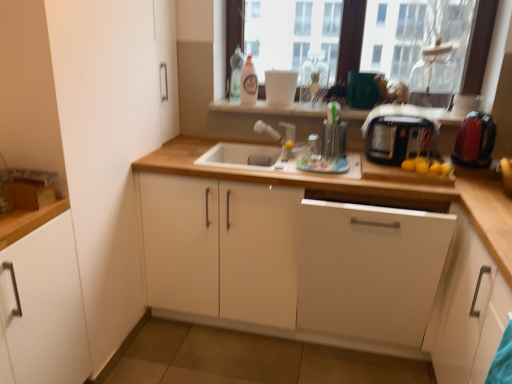
Describe the element at coordinates (270, 108) in the screenshot. I see `matte white window sill at upper center` at that location.

Find the location of a particular element. white matte cabinet at center, placed as the 3th cabinetry when sorted from left to right is located at coordinates point(370,270).

What do you see at coordinates (475, 141) in the screenshot? I see `shiny red plastic kettle at right` at bounding box center [475, 141].

This screenshot has height=384, width=512. Describe the element at coordinates (248, 83) in the screenshot. I see `white glossy bottle at upper center, marked as the second bottle in a right-to-left arrangement` at that location.

Measure the distance between point (490, 338) and camera.

Point (490, 338) is 1.30 meters away from camera.

What do you see at coordinates (397, 138) in the screenshot? The image size is (512, 384). I see `black plastic toaster at right` at bounding box center [397, 138].

Image resolution: width=512 pixels, height=384 pixels. In order to click on transparent glass window at upper center in this screenshot , I will do `click(479, 46)`.

Is black plastic toaster at right taller than white matte cabinet at lower right, which ranks as the second cabinetry in right-to-left order?

In fact, black plastic toaster at right may be shorter than white matte cabinet at lower right, which ranks as the second cabinetry in right-to-left order.

How different are the orientations of black plastic toaster at right and white matte cabinet at lower right, which ranks as the second cabinetry in right-to-left order, in degrees?

There is a 93.4-degree angle between the facing directions of black plastic toaster at right and white matte cabinet at lower right, which ranks as the second cabinetry in right-to-left order.

Identify the location of the 1st cabinetry positioned below the black plastic toaster at right (from a real-world perspective). (492, 328).

Measure the distance from black plastic toaster at right to white matte cabinet at lower right, which ranks as the second cabinetry in right-to-left order.

32.39 inches.

Is satin nickel faucet at center to the left of white matte cabinet at right, which is the 1th cabinetry from right to left, from the viewer's perspective?

Indeed, satin nickel faucet at center is positioned on the left side of white matte cabinet at right, which is the 1th cabinetry from right to left.

In terms of size, does satin nickel faucet at center appear bigger or smaller than white matte cabinet at right, which is the 1th cabinetry from right to left?

Considering their sizes, satin nickel faucet at center takes up less space than white matte cabinet at right, which is the 1th cabinetry from right to left.

Does satin nickel faucet at center come behind white matte cabinet at right, which is the 1th cabinetry from right to left?

Yes, it is.

Locate an element on the screen. This screenshot has width=512, height=384. faucet behind the white matte cabinet at right, the fifth cabinetry when ordered from left to right is located at coordinates (273, 136).

In the scene shown: Considering the relative sizes of white matte cabinet at lower right, the fourth cabinetry in the left-to-right sequence, and white matte cabinet at left, which is counted as the 1th cabinetry, starting from the left, in the image provided, is white matte cabinet at lower right, the fourth cabinetry in the left-to-right sequence, thinner than white matte cabinet at left, which is counted as the 1th cabinetry, starting from the left,?

Yes.

From a real-world perspective, who is located higher, white matte cabinet at lower right, which ranks as the second cabinetry in right-to-left order, or white matte cabinet at left, which is the fifth cabinetry in right-to-left order?

white matte cabinet at lower right, which ranks as the second cabinetry in right-to-left order.

From the image's perspective, which is above, white matte cabinet at lower right, which ranks as the second cabinetry in right-to-left order, or white matte cabinet at left, which is counted as the 1th cabinetry, starting from the left?

white matte cabinet at left, which is counted as the 1th cabinetry, starting from the left, from the image's perspective.

In terms of width, does matte white window sill at upper center look wider or thinner when compared to white matte cabinet at right, the fifth cabinetry when ordered from left to right?

matte white window sill at upper center is thinner than white matte cabinet at right, the fifth cabinetry when ordered from left to right.

Consider the image. Based on their positions, is matte white window sill at upper center located to the left or right of white matte cabinet at right, which is the 1th cabinetry from right to left?

Clearly, matte white window sill at upper center is on the left of white matte cabinet at right, which is the 1th cabinetry from right to left, in the image.

Considering the relative sizes of matte white window sill at upper center and white matte cabinet at right, which is the 1th cabinetry from right to left, in the image provided, is matte white window sill at upper center bigger than white matte cabinet at right, which is the 1th cabinetry from right to left,?

No.

Is matte white window sill at upper center facing away from white matte cabinet at right, the fifth cabinetry when ordered from left to right?

No, matte white window sill at upper center is not facing the opposite direction of white matte cabinet at right, the fifth cabinetry when ordered from left to right.

Is shiny red plastic kettle at right with white matte cabinet at left, which is the fifth cabinetry in right-to-left order?

There is a gap between shiny red plastic kettle at right and white matte cabinet at left, which is the fifth cabinetry in right-to-left order.

In the scene shown: Is shiny red plastic kettle at right positioned with its back to white matte cabinet at left, which is the fifth cabinetry in right-to-left order?

No, shiny red plastic kettle at right is not facing the opposite direction of white matte cabinet at left, which is the fifth cabinetry in right-to-left order.

Is shiny red plastic kettle at right at the left side of white matte cabinet at left, which is counted as the 1th cabinetry, starting from the left?

No.

From a real-world perspective, is shiny red plastic kettle at right above or below white matte cabinet at left, which is the fifth cabinetry in right-to-left order?

In terms of real-world spatial position, shiny red plastic kettle at right is above white matte cabinet at left, which is the fifth cabinetry in right-to-left order.

Does translucent plastic bottle at upper center, the 1th bottle viewed from the left, touch black plastic toaster at right?

translucent plastic bottle at upper center, the 1th bottle viewed from the left, and black plastic toaster at right are clearly separated.

Which is closer, (231, 96) or (388, 147)?

The point (388, 147) is more forward.

How far apart are translucent plastic bottle at upper center, the third bottle positioned from the right, and black plastic toaster at right?

translucent plastic bottle at upper center, the third bottle positioned from the right, is 1.03 meters away from black plastic toaster at right.

Is translucent plastic bottle at upper center, the third bottle positioned from the right, spatially inside black plastic toaster at right, or outside of it?

The correct answer is: outside.

Would you say white matte cabinet at lower right, the fourth cabinetry in the left-to-right sequence, is inside or outside white matte cabinet at center, the 2th cabinetry positioned from the left?

white matte cabinet at lower right, the fourth cabinetry in the left-to-right sequence, is not inside white matte cabinet at center, the 2th cabinetry positioned from the left, it's outside.

In the scene shown: Considering the sizes of objects white matte cabinet at lower right, which ranks as the second cabinetry in right-to-left order, and white matte cabinet at center, the fourth cabinetry viewed from the right, in the image provided, who is smaller, white matte cabinet at lower right, which ranks as the second cabinetry in right-to-left order, or white matte cabinet at center, the fourth cabinetry viewed from the right,?

Smaller between the two is white matte cabinet at lower right, which ranks as the second cabinetry in right-to-left order.

What's the angular difference between white matte cabinet at lower right, which ranks as the second cabinetry in right-to-left order, and white matte cabinet at center, the 2th cabinetry positioned from the left,'s facing directions?

white matte cabinet at lower right, which ranks as the second cabinetry in right-to-left order, and white matte cabinet at center, the 2th cabinetry positioned from the left, are facing 93.6 degrees away from each other.

Is white matte cabinet at lower right, which ranks as the second cabinetry in right-to-left order, at the left side of white matte cabinet at center, the 2th cabinetry positioned from the left?

Incorrect, white matte cabinet at lower right, which ranks as the second cabinetry in right-to-left order, is not on the left side of white matte cabinet at center, the 2th cabinetry positioned from the left.

At what (x,y) coordinates should I click in order to perform the action: click on the 4th cabinetry in front when counting from the black plastic toaster at right. Please return your answer as a coordinate pair (x, y). Looking at the image, I should click on (492, 328).

Where is `faucet on the left of white matte cabinet at right, the fifth cabinetry when ordered from left to right`? This screenshot has height=384, width=512. faucet on the left of white matte cabinet at right, the fifth cabinetry when ordered from left to right is located at coordinates (273, 136).

Which object lies further to the anchor point white matte cabinet at left, which is counted as the 1th cabinetry, starting from the left, white matte cabinet at center, which is counted as the third cabinetry, starting from the right, or white matte cabinet at right, which is the 1th cabinetry from right to left?

The object further to white matte cabinet at left, which is counted as the 1th cabinetry, starting from the left, is white matte cabinet at right, which is the 1th cabinetry from right to left.

When comparing their distances from satin nickel faucet at center, does white matte cabinet at center, placed as the 3th cabinetry when sorted from left to right, or white matte cabinet at right, which is the 1th cabinetry from right to left, seem further?

Among the two, white matte cabinet at right, which is the 1th cabinetry from right to left, is located further to satin nickel faucet at center.

When comparing their distances from white matte cabinet at right, the fifth cabinetry when ordered from left to right, does shiny red plastic kettle at right or transparent glass bottle at upper center, which appears as the 3th bottle when viewed from the left, seem closer?

shiny red plastic kettle at right.

Based on their spatial positions, is white matte cabinet at left, which is counted as the 1th cabinetry, starting from the left, or shiny red plastic kettle at right closer to white matte cabinet at right, the fifth cabinetry when ordered from left to right?

Among the two, shiny red plastic kettle at right is located nearer to white matte cabinet at right, the fifth cabinetry when ordered from left to right.

From the image, which object appears to be nearer to white matte cabinet at center, the 2th cabinetry positioned from the left, transparent glass window at upper center or shiny red plastic kettle at right?

shiny red plastic kettle at right is closer to white matte cabinet at center, the 2th cabinetry positioned from the left.

When comparing their distances from white matte cabinet at left, which is counted as the 1th cabinetry, starting from the left, does transparent glass window at upper center or white matte cabinet at center, placed as the 3th cabinetry when sorted from left to right, seem closer?

white matte cabinet at center, placed as the 3th cabinetry when sorted from left to right, is closer to white matte cabinet at left, which is counted as the 1th cabinetry, starting from the left.

Looking at the image, which one is located further to white matte cabinet at center, the fourth cabinetry viewed from the right, white matte cabinet at lower right, which ranks as the second cabinetry in right-to-left order, or white glossy bottle at upper center, marked as the second bottle in a right-to-left arrangement?

The object further to white matte cabinet at center, the fourth cabinetry viewed from the right, is white glossy bottle at upper center, marked as the second bottle in a right-to-left arrangement.

Based on their spatial positions, is satin nickel faucet at center or shiny red plastic kettle at right closer to white matte cabinet at lower right, which ranks as the second cabinetry in right-to-left order?

shiny red plastic kettle at right.

In order to click on window sill between white matte cabinet at left, which is counted as the 1th cabinetry, starting from the left, and white matte cabinet at right, the fifth cabinetry when ordered from left to right, in the horizontal direction in this screenshot , I will do `click(270, 108)`.

I want to click on toaster between white matte cabinet at lower right, the fourth cabinetry in the left-to-right sequence, and matte white window sill at upper center in the front-back direction, so click(x=397, y=138).

Find the location of a particular element. The height and width of the screenshot is (384, 512). bottle between white glossy bottle at upper center, marked as the second bottle in a right-to-left arrangement, and matte white window sill at upper center is located at coordinates [317, 75].

Where is `window between satin nickel faucet at center and shiny red plastic kettle at right in the horizontal direction`? The width and height of the screenshot is (512, 384). window between satin nickel faucet at center and shiny red plastic kettle at right in the horizontal direction is located at coordinates coord(479,46).